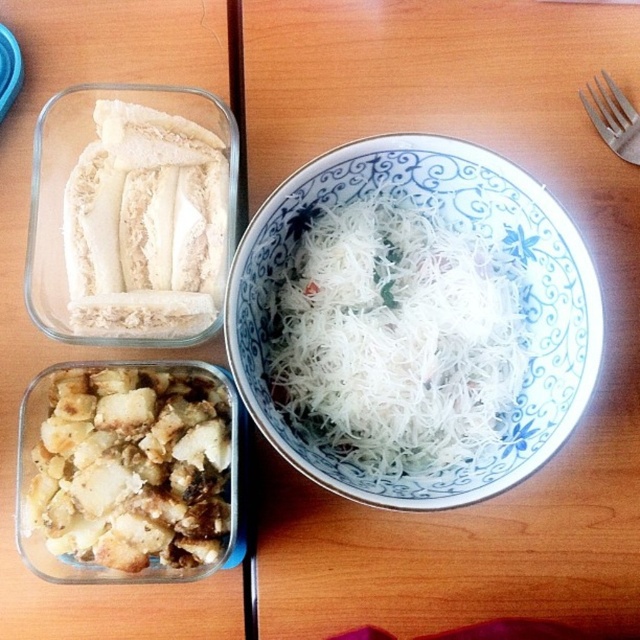
You are standing at the camera position and want to reach the point at coordinates (496, 221). Is this point within your immediate reach without moving your feet?

The point at coordinates (496, 221) is 38.46 inches away from the camera, which is approximately 3.2 feet. Since this distance is within typical arm reach, you can likely reach it without moving your feet.

You are a food delivery person who needs to stack these items in a delivery box. The noodles are fragile and must be placed on top of the bread to avoid crushing them. Based on their current positions in the image, can you confirm if the white porcelain noodles at center are already positioned above the brown crumbly bread at bottom left?

Yes, the white porcelain noodles at center are already positioned above the brown crumbly bread at bottom left, so they are correctly placed for delivery without needing rearrangement.